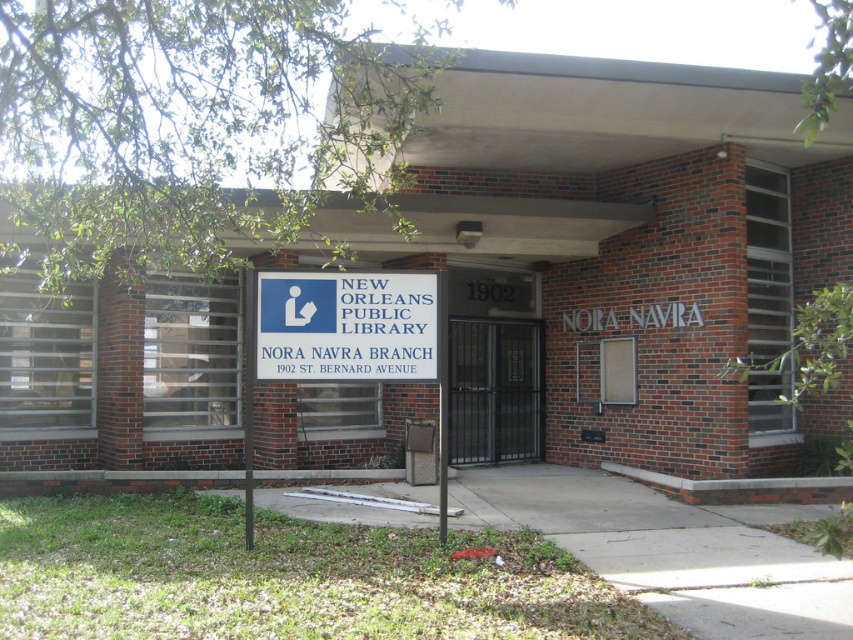
Question: Among these points, which one is nearest to the camera?

Choices:
 (A) (466, 342)
 (B) (399, 374)

Answer: (B)

Question: Is blue plastic sign at center wider than metallic gate at center?

Choices:
 (A) yes
 (B) no

Answer: (A)

Question: Among these points, which one is farthest from the camera?

Choices:
 (A) (479, 458)
 (B) (264, 284)

Answer: (A)

Question: Which of the following is the closest to the observer?

Choices:
 (A) (465, 328)
 (B) (289, 339)

Answer: (B)

Question: Is blue plastic sign at center below metallic gate at center?

Choices:
 (A) no
 (B) yes

Answer: (A)

Question: Is blue plastic sign at center below metallic gate at center?

Choices:
 (A) no
 (B) yes

Answer: (A)